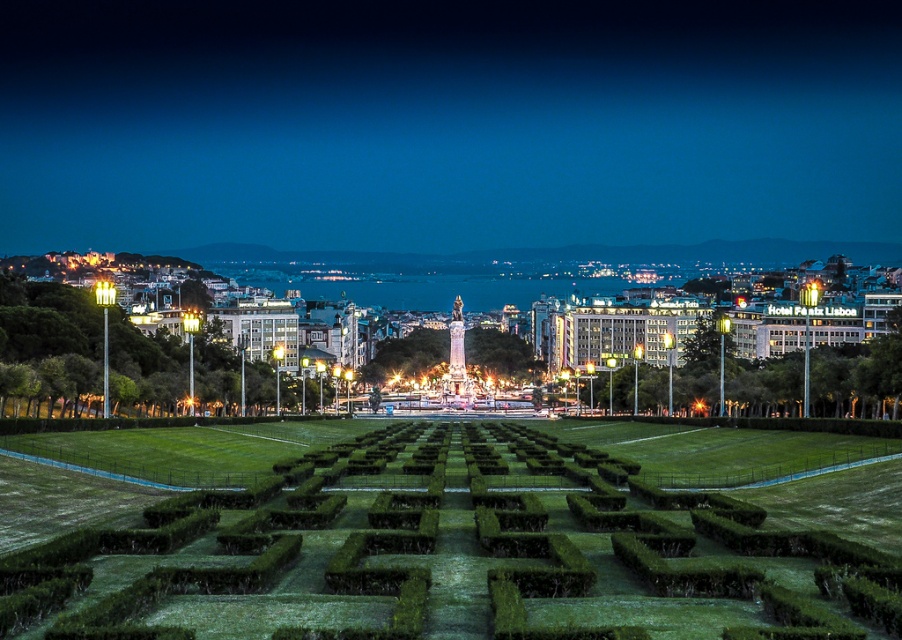
Does point (8, 332) come in front of point (678, 412)?

Yes.

Consider the image. Who is positioned more to the left, green grass hedge at left or green grass hedge at center?

green grass hedge at left

Is point (235, 352) closer to camera compared to point (657, 390)?

No, it is not.

Identify the location of green grass hedge at left. The image size is (902, 640). (195, 356).

Is dark blue sky at upper center bigger than green textured hedge at center?

Yes, dark blue sky at upper center is bigger than green textured hedge at center.

Is point (446, 160) closer to camera compared to point (576, 490)?

No, (446, 160) is behind (576, 490).

At what (x,y) coordinates should I click in order to perform the action: click on dark blue sky at upper center. Please return your answer as a coordinate pair (x, y). This screenshot has height=640, width=902. Looking at the image, I should click on (447, 122).

What are the coordinates of `dark blue sky at upper center` in the screenshot? It's located at [x=447, y=122].

At what (x,y) coordinates should I click in order to perform the action: click on green textured hedge at center. Please return your answer as a coordinate pair (x, y). This screenshot has height=640, width=902. Looking at the image, I should click on (447, 552).

Is point (217, 548) positioned after point (735, 392)?

That is False.

Locate an element on the screen. The width and height of the screenshot is (902, 640). green textured hedge at center is located at coordinates (447, 552).